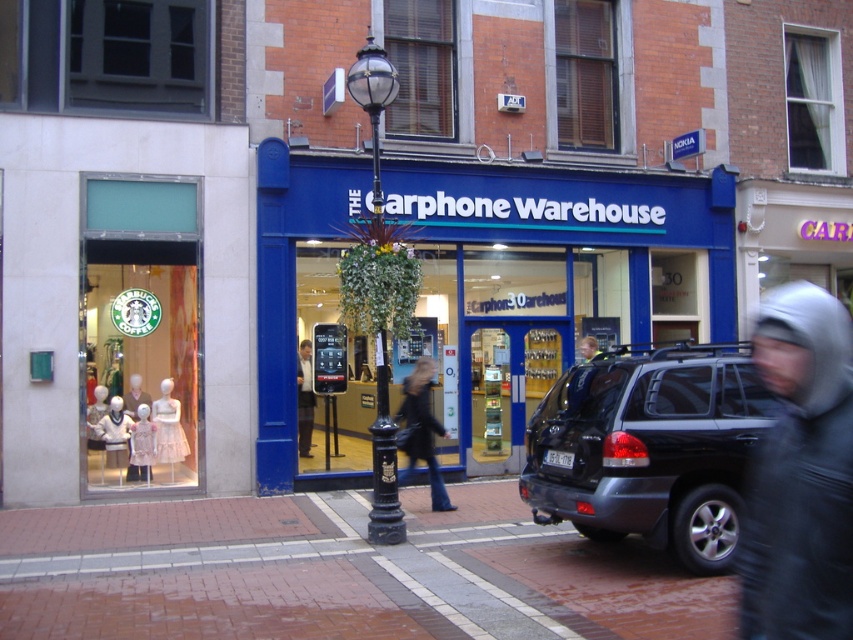
Does point (769, 406) lie behind point (401, 429)?

No, it is not.

Based on the photo, between dark gray suv at right and black leather jacket at center, which one has less height?

black leather jacket at center is shorter.

Is point (561, 513) closer to viewer compared to point (428, 467)?

Yes.

Find the location of a particular element. The image size is (853, 640). dark gray suv at right is located at coordinates pos(650,448).

Does brick pavement at lower center have a lesser width compared to blue matte signboard at center?

No.

In order to click on brick pavement at lower center in this screenshot , I will do `click(338, 573)`.

Is brick pavement at lower center to the left of matte white dress at center from the viewer's perspective?

In fact, brick pavement at lower center is to the right of matte white dress at center.

Does point (515, 564) lie in front of point (163, 388)?

Yes, it is in front of point (163, 388).

Find the location of a particular element. brick pavement at lower center is located at coordinates (338, 573).